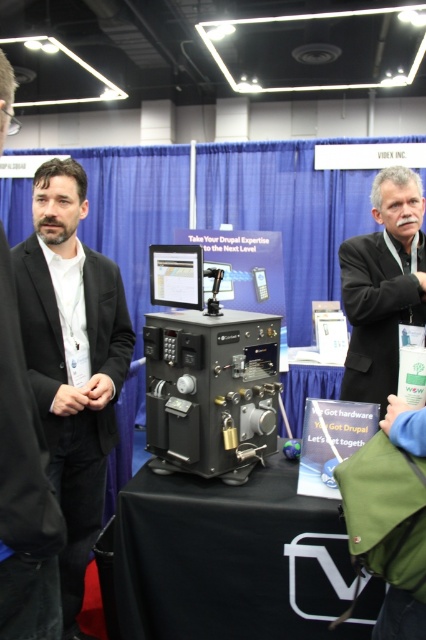
Is black matte/finish industrial machine at center closer to the viewer compared to black suit at center?

Yes, black matte/finish industrial machine at center is closer to the viewer.

Is point (213, 401) farther from camera compared to point (370, 378)?

That is False.

The image size is (426, 640). I want to click on black matte/finish industrial machine at center, so click(210, 387).

Does point (17, 326) come closer to viewer compared to point (402, 176)?

Yes, point (17, 326) is closer to viewer.

Is point (8, 602) more distant than point (342, 266)?

No, (8, 602) is in front of (342, 266).

Find the location of a particular element. matte black suit at left is located at coordinates (23, 490).

Is black fabric table at center to the right of black matte/finish industrial machine at center from the viewer's perspective?

Yes, black fabric table at center is to the right of black matte/finish industrial machine at center.

Between black fabric table at center and black matte/finish industrial machine at center, which one is positioned lower?

Positioned lower is black fabric table at center.

Where is `black fabric table at center`? The width and height of the screenshot is (426, 640). black fabric table at center is located at coordinates (233, 561).